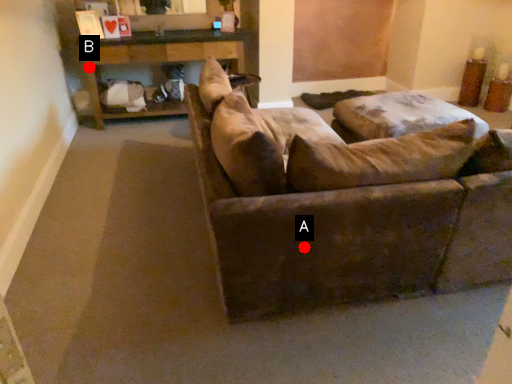
Question: Two points are circled on the image, labeled by A and B beside each circle. Among these points, which one is farthest from the camera?

Choices:
 (A) A is further
 (B) B is further

Answer: (B)